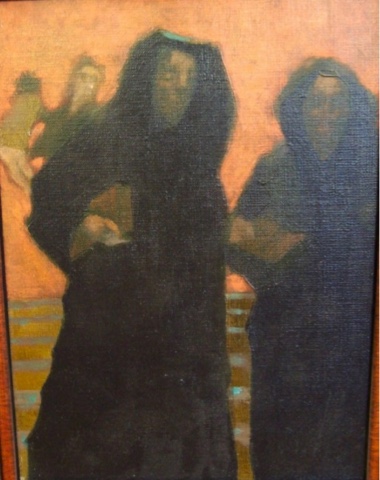
Identify the location of robe. (171, 208), (325, 234).